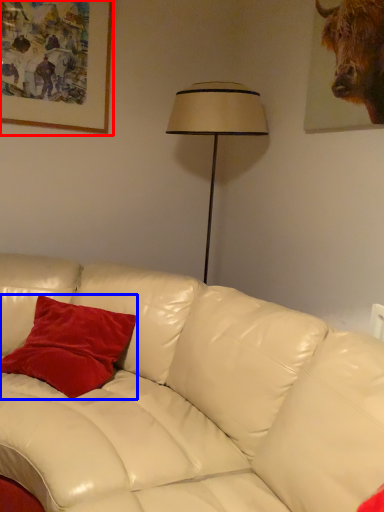
Question: Which object is closer to the camera taking this photo, picture frame (highlighted by a red box) or pillow (highlighted by a blue box)?

Choices:
 (A) picture frame
 (B) pillow

Answer: (B)